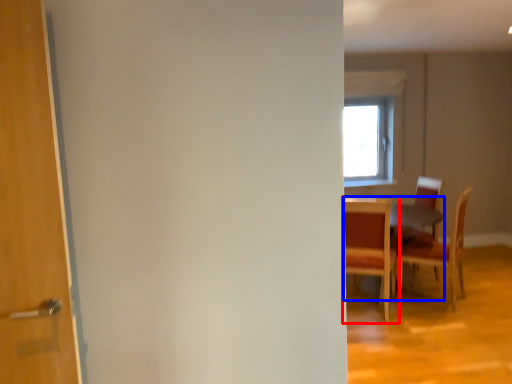
Question: Which point is closer to the camera, chair (highlighted by a red box) or table (highlighted by a blue box)?

Choices:
 (A) chair
 (B) table

Answer: (A)